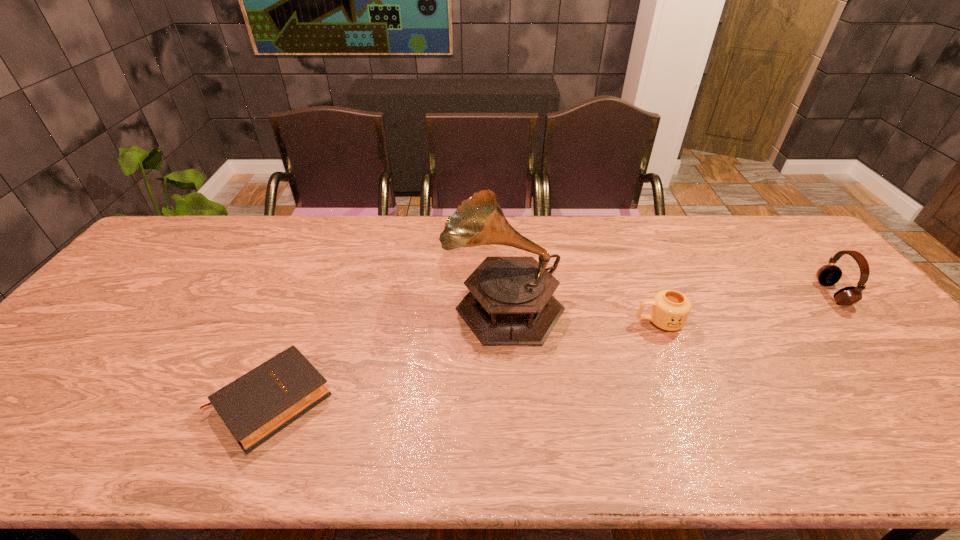
The width and height of the screenshot is (960, 540). What are the coordinates of `vacant space at the far edge` in the screenshot? It's located at (558, 249).

In order to click on free region at the near edge of the desktop in this screenshot , I will do `click(713, 460)`.

This screenshot has height=540, width=960. In the image, there is a desktop. In order to click on vacant space at the left edge in this screenshot , I will do `click(177, 269)`.

Where is `vacant area at the right edge of the desktop`? The width and height of the screenshot is (960, 540). vacant area at the right edge of the desktop is located at coordinates point(877,377).

Find the location of a particular element. Image resolution: width=960 pixels, height=540 pixels. free space between the Bible and the phonograph record is located at coordinates (387, 352).

I want to click on free space between the nearest object and the second shortest object, so click(x=466, y=361).

The width and height of the screenshot is (960, 540). Find the location of `free space between the mug and the phonograph record`. free space between the mug and the phonograph record is located at coordinates (581, 313).

The width and height of the screenshot is (960, 540). Identify the location of free space between the nearest object and the phonograph record. (387, 352).

At what (x,y) coordinates should I click in order to perform the action: click on free area in between the second object from right to left and the rightmost object. Please return your answer as a coordinate pair (x, y). Looking at the image, I should click on (746, 308).

Find the location of `free spot between the nearest object and the phonograph record`. free spot between the nearest object and the phonograph record is located at coordinates [x=387, y=352].